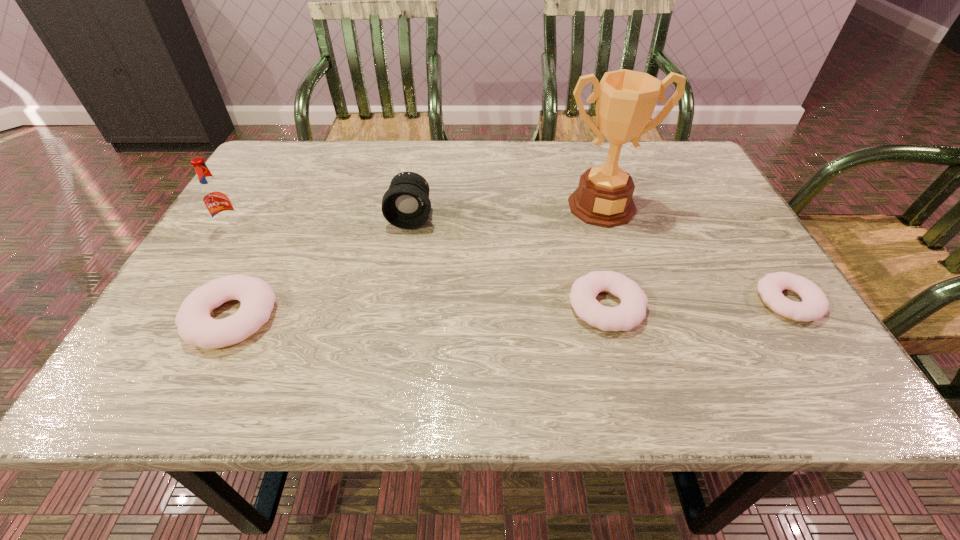
Locate an element on the screen. This screenshot has width=960, height=540. object present at the near right corner is located at coordinates (814, 305).

Locate an element on the screen. This screenshot has width=960, height=540. vacant region at the far edge of the desktop is located at coordinates (565, 140).

Find the location of a particular element. Image resolution: width=960 pixels, height=540 pixels. vacant space at the near edge is located at coordinates (597, 332).

Find the location of `vacant space at the left edge`. vacant space at the left edge is located at coordinates (248, 210).

Where is `vacant point at the right edge`? The width and height of the screenshot is (960, 540). vacant point at the right edge is located at coordinates (730, 294).

Where is `vacant region at the far left corner of the desktop`? This screenshot has height=540, width=960. vacant region at the far left corner of the desktop is located at coordinates (268, 150).

Image resolution: width=960 pixels, height=540 pixels. In order to click on vacant space at the far right corner of the desktop in this screenshot , I will do `click(639, 147)`.

Locate an element on the screen. vacant area between the rightmost doughnut and the telephoto lens is located at coordinates (600, 259).

Where is `free space between the telephoto lens and the award`? The height and width of the screenshot is (540, 960). free space between the telephoto lens and the award is located at coordinates (506, 212).

Locate an element on the screen. This screenshot has height=540, width=960. vacant space that is in between the second shortest doughnut and the root beer is located at coordinates (420, 268).